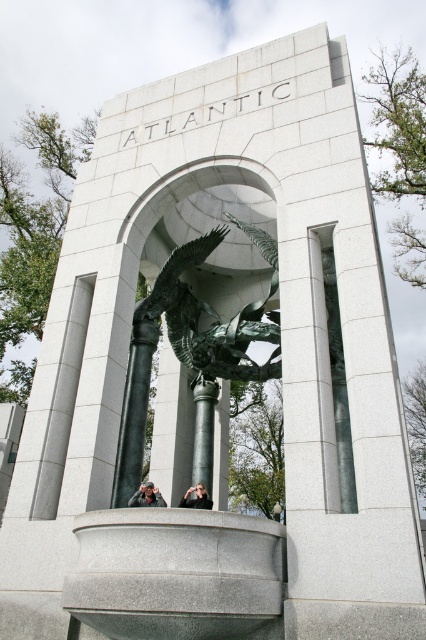
Question: Can you confirm if bronze/golden eagle at center is wider than dark brown leather jacket at lower center?

Choices:
 (A) yes
 (B) no

Answer: (A)

Question: Observing the image, what is the correct spatial positioning of dark brown leather jacket at lower center in reference to matte black camera at center?

Choices:
 (A) above
 (B) below

Answer: (A)

Question: Which object appears closest to the camera in this image?

Choices:
 (A) matte black camera at center
 (B) bronze/golden eagle at center

Answer: (A)

Question: Which of the following is the farthest from the observer?

Choices:
 (A) (198, 387)
 (B) (131, 499)
 (C) (204, 486)

Answer: (A)

Question: Does black polished stone column at center have a larger size compared to matte black camera at center?

Choices:
 (A) yes
 (B) no

Answer: (A)

Question: Among these points, which one is nearest to the camera?

Choices:
 (A) (138, 317)
 (B) (195, 451)
 (C) (181, 506)

Answer: (C)